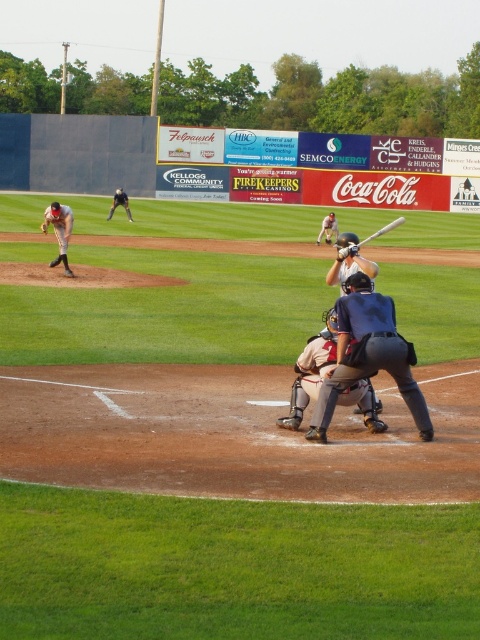
You are a photographer positioned behind home plate. You want to take a photo that includes both the white leather catcher at center and the white uniform at left. Which of these two objects should you adjust your camera angle to focus on first to ensure both are in frame?

The white leather catcher at center has a lesser height compared to the white uniform at left. To ensure both are in frame, focus on the taller object first, which is the white uniform at left, then adjust to include the shorter white leather catcher at center.

Based on the coordinates provided, where exactly is the white uniform at left located in the image?

The white uniform at left is located at point [60,230].

You are a photographer positioned at the edge of the field. You need to capture a closeup shot of the matte gray helmet at center and the dark gray uniform at center. Since you want both objects to be clearly visible in the frame, which object should you focus on to ensure the smaller one is in sharp detail?

The matte gray helmet at center has a smaller size compared to the dark gray uniform at center. To ensure the smaller object is in sharp detail, you should focus on the matte gray helmet at center.